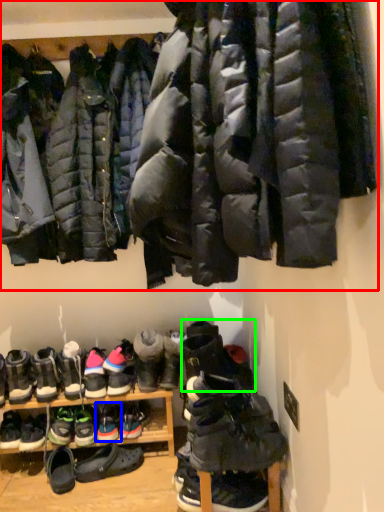
Question: Estimate the real-world distances between objects in this image. Which object is closer to jacket (highlighted by a red box), footwear (highlighted by a blue box) or footwear (highlighted by a green box)?

Choices:
 (A) footwear
 (B) footwear

Answer: (B)